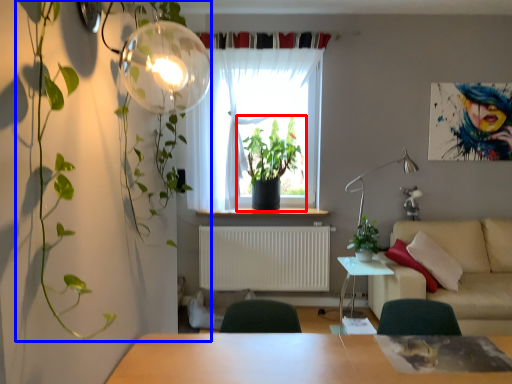
Question: Which object is further to the camera taking this photo, houseplant (highlighted by a red box) or vegetation (highlighted by a blue box)?

Choices:
 (A) houseplant
 (B) vegetation

Answer: (A)